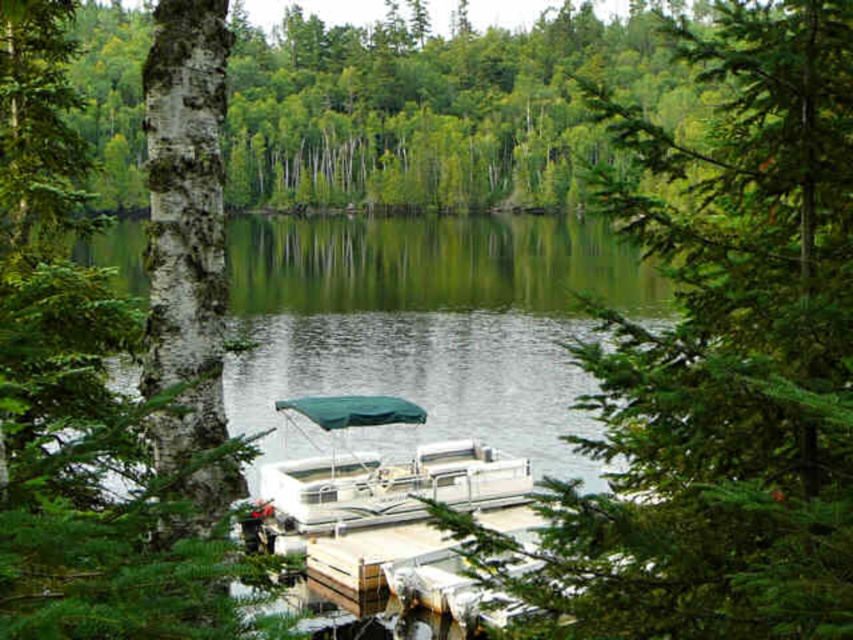
You are planning to take a photo of the white bark tree at left and the white plastic pontoon boat at center. Which object should you focus on first if you want to capture both in the same frame without moving the camera?

You should focus on the white plastic pontoon boat at center first because it is thicker than the white bark tree at left, making it easier to frame both objects in the same shot.

You are planning to paint a landscape of the lakeside scene. You have a canvas that can only accommodate the width of the white bark tree at left. Can you fit the green smooth water at center on the same canvas without cropping it?

The white bark tree at left is narrower than the green smooth water at center. Since the canvas can only fit the width of the white bark tree at left, it cannot accommodate the wider green smooth water at center without cropping.